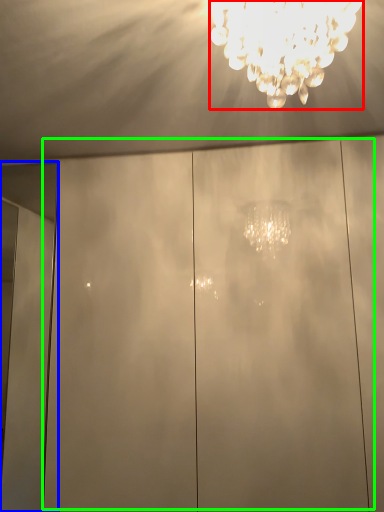
Question: Estimate the real-world distances between objects in this image. Which object is closer to lamp (highlighted by a red box), door (highlighted by a blue box) or glass door (highlighted by a green box)?

Choices:
 (A) door
 (B) glass door

Answer: (B)